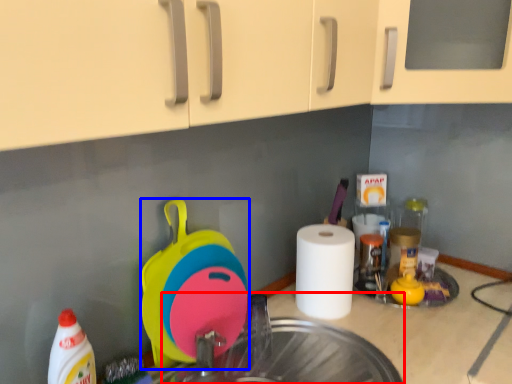
Question: Which object appears closest to the camera in this image, sink (highlighted by a red box) or appliance (highlighted by a blue box)?

Choices:
 (A) sink
 (B) appliance

Answer: (A)